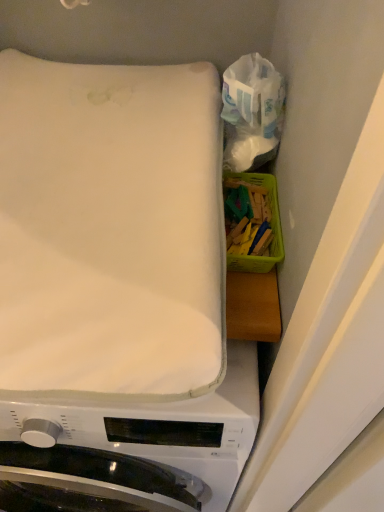
Question: Does point (228, 132) appear closer or farther from the camera than point (1, 273)?

Choices:
 (A) closer
 (B) farther

Answer: (B)

Question: From the image's perspective, is translucent plastic bag at upper right above or below white soft mattress at upper left?

Choices:
 (A) above
 (B) below

Answer: (A)

Question: Estimate the real-world distances between objects in this image. Which object is closer to the white soft mattress at upper left?

Choices:
 (A) translucent plastic bag at upper right
 (B) white fabric at upper left

Answer: (A)

Question: Which of these objects is positioned farthest from the white soft mattress at upper left?

Choices:
 (A) white fabric at upper left
 (B) translucent plastic bag at upper right

Answer: (A)